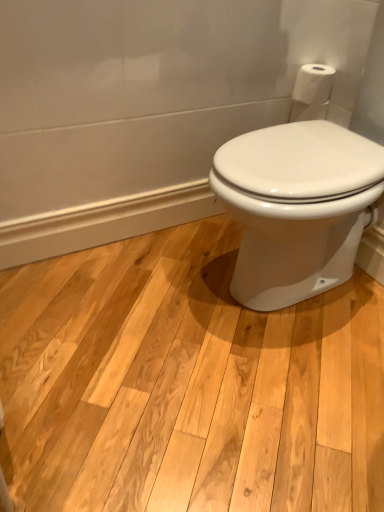
The image size is (384, 512). What do you see at coordinates (313, 84) in the screenshot? I see `white matte toilet paper at upper right` at bounding box center [313, 84].

Locate an element on the screen. This screenshot has height=512, width=384. white matte toilet paper at upper right is located at coordinates (313, 84).

Locate an element on the screen. Image resolution: width=384 pixels, height=512 pixels. white matte toilet paper at upper right is located at coordinates (313, 84).